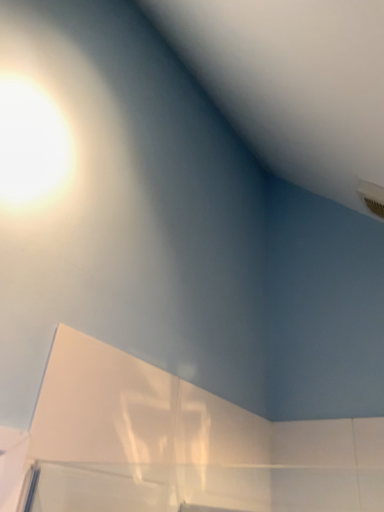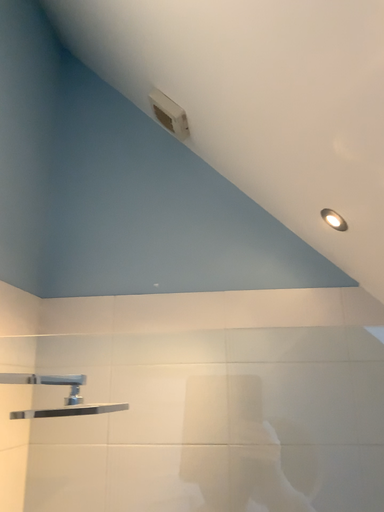
Question: How did the camera likely rotate when shooting the video?

Choices:
 (A) rotated left
 (B) rotated right

Answer: (B)